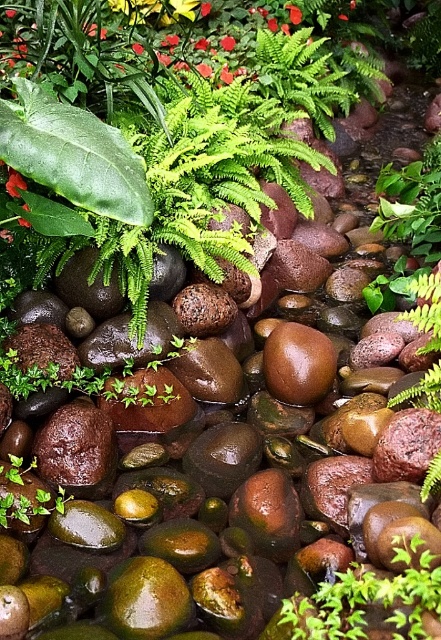
Question: Which point is farther from the camera taking this photo?

Choices:
 (A) (332, 349)
 (B) (284, 6)
 (C) (231, 38)

Answer: (B)

Question: Does shiny brown rock at center have a larger size compared to smooth glossy petal at center?

Choices:
 (A) no
 (B) yes

Answer: (B)

Question: Is smooth glossy petal at center above red matte flower at upper center?

Choices:
 (A) no
 (B) yes

Answer: (B)

Question: Which point is closer to the camera taking this photo?

Choices:
 (A) (272, 387)
 (B) (295, 10)

Answer: (A)

Question: Is smooth glossy petal at center positioned at the back of red matte flower at upper center?

Choices:
 (A) no
 (B) yes

Answer: (B)

Question: Which point appears closest to the camera in this image?

Choices:
 (A) (294, 4)
 (B) (306, 344)

Answer: (B)